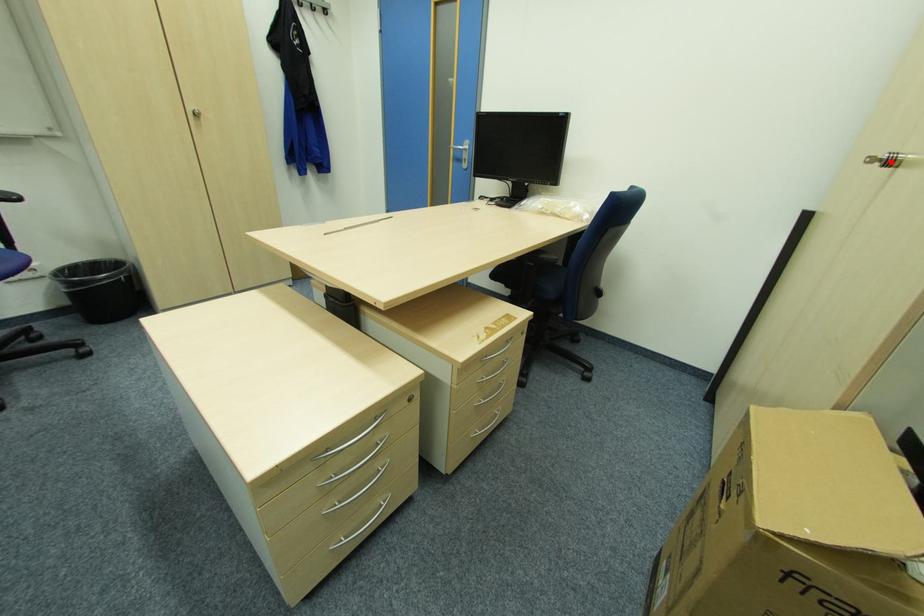
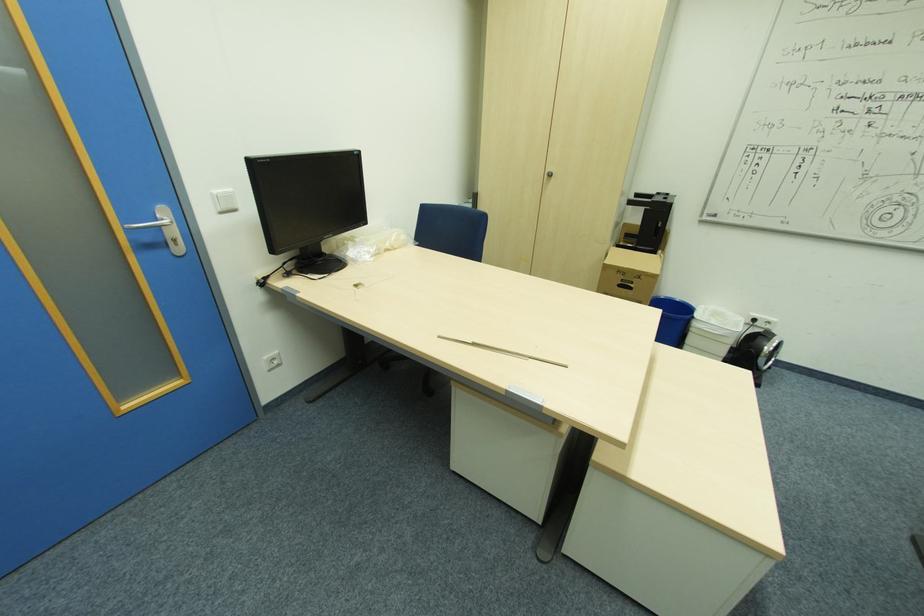
Where in the second image is the point corresponding to the highlighted location from the first image?

(553, 175)